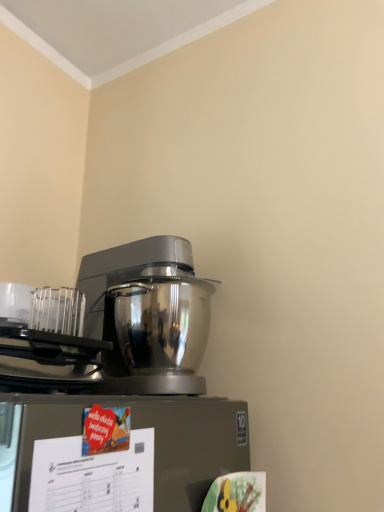
Question: From a real-world perspective, is satin silver mixer at center beneath brushed metal stand mixer at left?

Choices:
 (A) no
 (B) yes

Answer: (A)

Question: Does satin silver mixer at center have a lesser height compared to brushed metal stand mixer at left?

Choices:
 (A) no
 (B) yes

Answer: (A)

Question: Is satin silver mixer at center oriented towards brushed metal stand mixer at left?

Choices:
 (A) no
 (B) yes

Answer: (A)

Question: Considering the relative sizes of satin silver mixer at center and brushed metal stand mixer at left in the image provided, is satin silver mixer at center taller than brushed metal stand mixer at left?

Choices:
 (A) yes
 (B) no

Answer: (A)

Question: Is satin silver mixer at center bigger than brushed metal stand mixer at left?

Choices:
 (A) no
 (B) yes

Answer: (B)

Question: Can you confirm if satin silver mixer at center is positioned to the left of brushed metal stand mixer at left?

Choices:
 (A) yes
 (B) no

Answer: (B)

Question: From the image's perspective, would you say brushed metal stand mixer at left is shown under satin silver mixer at center?

Choices:
 (A) yes
 (B) no

Answer: (A)

Question: Can you confirm if brushed metal stand mixer at left is positioned to the right of satin silver mixer at center?

Choices:
 (A) yes
 (B) no

Answer: (B)

Question: Does brushed metal stand mixer at left have a smaller size compared to satin silver mixer at center?

Choices:
 (A) yes
 (B) no

Answer: (A)

Question: Does brushed metal stand mixer at left contain satin silver mixer at center?

Choices:
 (A) yes
 (B) no

Answer: (B)

Question: Can you confirm if brushed metal stand mixer at left is taller than satin silver mixer at center?

Choices:
 (A) no
 (B) yes

Answer: (A)

Question: Is brushed metal stand mixer at left to the left of satin silver mixer at center from the viewer's perspective?

Choices:
 (A) no
 (B) yes

Answer: (B)

Question: Do you think satin silver mixer at center is within brushed metal stand mixer at left, or outside of it?

Choices:
 (A) inside
 (B) outside

Answer: (B)